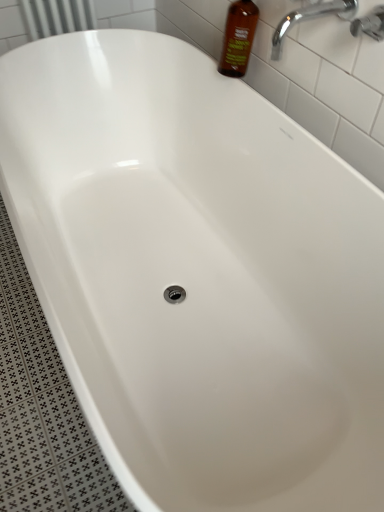
Question: From the image's perspective, would you say chrome metallic faucet at upper right is shown under brown glass bottle at upper right?

Choices:
 (A) yes
 (B) no

Answer: (A)

Question: Does chrome metallic faucet at upper right have a smaller size compared to brown glass bottle at upper right?

Choices:
 (A) yes
 (B) no

Answer: (A)

Question: Is chrome metallic faucet at upper right not near brown glass bottle at upper right?

Choices:
 (A) yes
 (B) no

Answer: (B)

Question: Does chrome metallic faucet at upper right have a larger size compared to brown glass bottle at upper right?

Choices:
 (A) no
 (B) yes

Answer: (A)

Question: From a real-world perspective, is chrome metallic faucet at upper right located higher than brown glass bottle at upper right?

Choices:
 (A) yes
 (B) no

Answer: (A)

Question: Is chrome metallic faucet at upper right facing towards brown glass bottle at upper right?

Choices:
 (A) yes
 (B) no

Answer: (B)

Question: Is chrome metallic faucet at upper right to the left of chrome metallic faucet at upper right from the viewer's perspective?

Choices:
 (A) yes
 (B) no

Answer: (B)

Question: Is chrome metallic faucet at upper right looking in the opposite direction of chrome metallic faucet at upper right?

Choices:
 (A) yes
 (B) no

Answer: (B)

Question: Is chrome metallic faucet at upper right further to camera compared to chrome metallic faucet at upper right?

Choices:
 (A) no
 (B) yes

Answer: (A)

Question: Does chrome metallic faucet at upper right have a larger size compared to chrome metallic faucet at upper right?

Choices:
 (A) yes
 (B) no

Answer: (B)

Question: Is chrome metallic faucet at upper right to the right of chrome metallic faucet at upper right from the viewer's perspective?

Choices:
 (A) no
 (B) yes

Answer: (B)

Question: Is chrome metallic faucet at upper right next to chrome metallic faucet at upper right and touching it?

Choices:
 (A) no
 (B) yes

Answer: (A)

Question: Is brown glass bottle at upper right aimed at chrome metallic faucet at upper right?

Choices:
 (A) yes
 (B) no

Answer: (B)